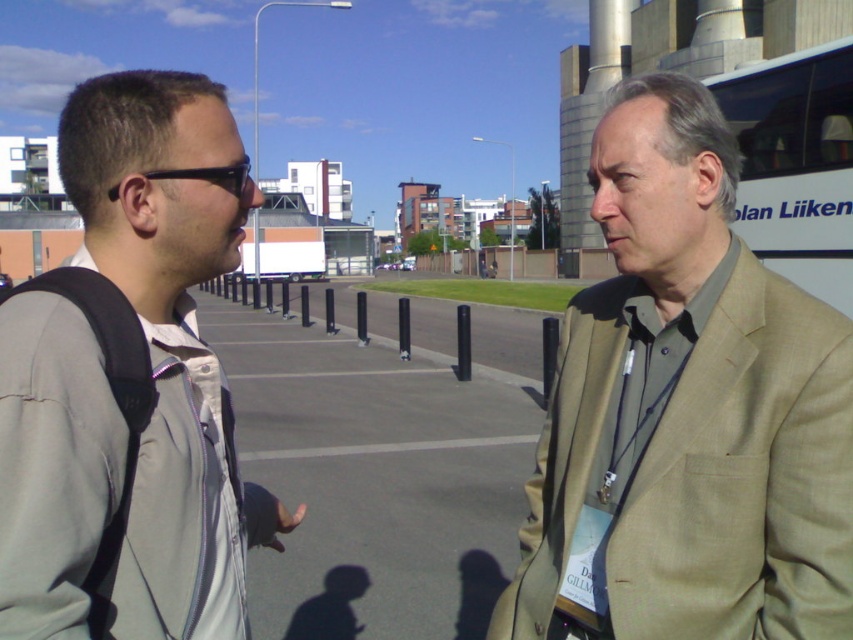
Is tan fabric suit at right shorter than white matte bus at right?

Indeed, tan fabric suit at right has a lesser height compared to white matte bus at right.

Which is more to the left, tan fabric suit at right or white matte bus at right?

Positioned to the left is tan fabric suit at right.

The height and width of the screenshot is (640, 853). Describe the element at coordinates (686, 413) in the screenshot. I see `tan fabric suit at right` at that location.

Locate an element on the screen. Image resolution: width=853 pixels, height=640 pixels. tan fabric suit at right is located at coordinates (686, 413).

Which is more to the right, black asphalt parking lot at center or white matte bus at right?

Positioned to the right is white matte bus at right.

Which is behind, point (352, 596) or point (850, 253)?

Point (850, 253)

At what (x,y) coordinates should I click in order to perform the action: click on black asphalt parking lot at center. Please return your answer as a coordinate pair (x, y). Looking at the image, I should click on (374, 481).

Identify the location of black asphalt parking lot at center. The width and height of the screenshot is (853, 640). (374, 481).

Does point (848, 307) lie in front of point (238, 186)?

No.

Find the location of a particular element. white matte bus at right is located at coordinates (796, 164).

Where is `white matte bus at right`? Image resolution: width=853 pixels, height=640 pixels. white matte bus at right is located at coordinates (796, 164).

Where is `white matte bus at right`? Image resolution: width=853 pixels, height=640 pixels. white matte bus at right is located at coordinates (796, 164).